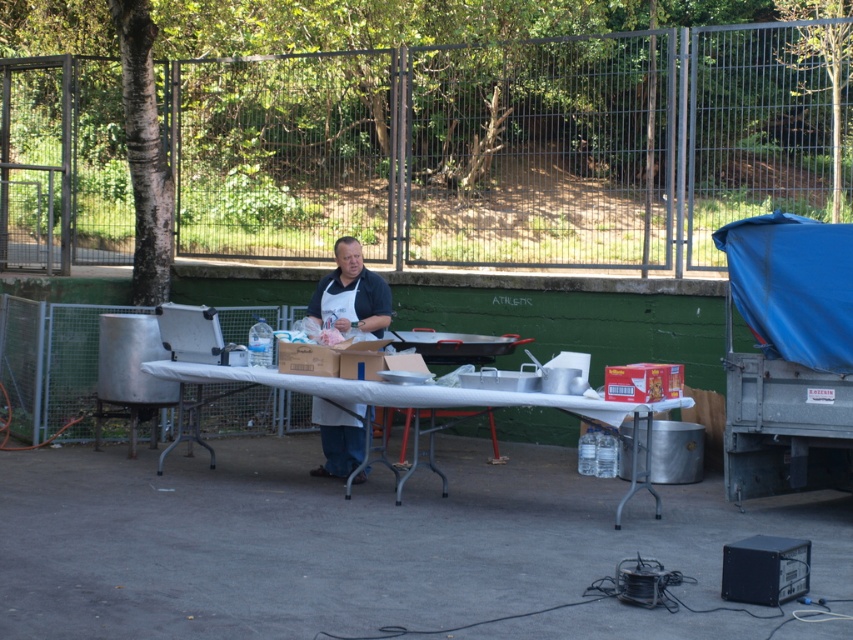
Question: Can you confirm if matte apron at center is thinner than brown cardboard box at center?

Choices:
 (A) no
 (B) yes

Answer: (B)

Question: Estimate the real-world distances between objects in this image. Which object is farther from the brown cardboard box at center?

Choices:
 (A) matte apron at center
 (B) white plastic table at center

Answer: (A)

Question: Can you confirm if white plastic table at center is positioned to the left of matte apron at center?

Choices:
 (A) no
 (B) yes

Answer: (A)

Question: Which object appears closest to the camera in this image?

Choices:
 (A) matte apron at center
 (B) white plastic table at center
 (C) brown cardboard box at center

Answer: (B)

Question: Does white plastic table at center come behind brown cardboard box at center?

Choices:
 (A) no
 (B) yes

Answer: (A)

Question: Which object is the farthest from the white plastic table at center?

Choices:
 (A) brown cardboard box at center
 (B) matte apron at center

Answer: (B)